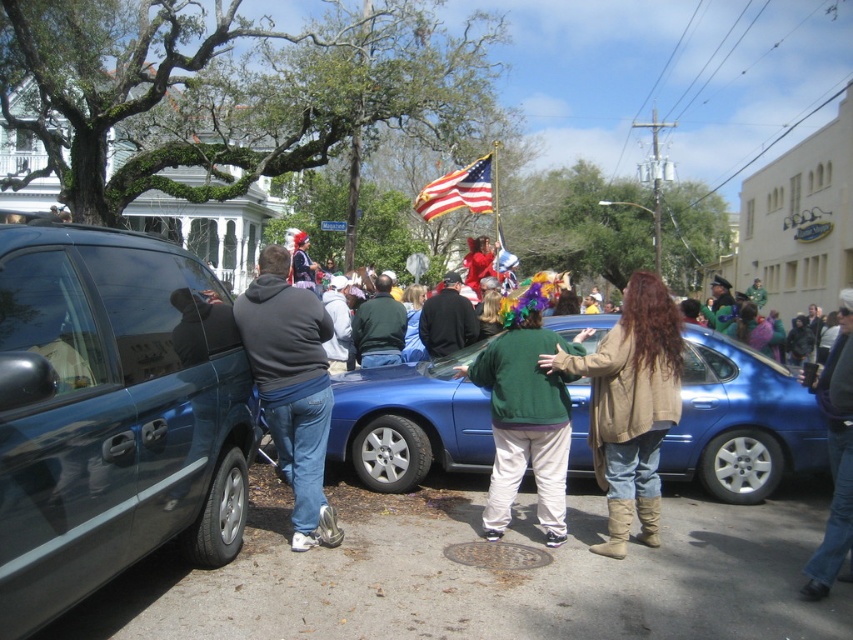
You are a delivery person who needs to park your 15 feet long truck between the blue metallic car at center and the american flag at center. Is there enough space between them to park your truck?

The blue metallic car at center and american flag at center are 20.51 feet apart. Since your truck is 15 feet long, there is enough space between them to park your truck as 20.51 feet is greater than 15 feet.

You are a photographer trying to capture both the green fleece jacket at center and the black matte jacket at center in a single shot. Based on their positions, which jacket should you focus on first to ensure both are in the frame?

The green fleece jacket at center is located below the black matte jacket at center, so you should focus on the black matte jacket at center first to ensure both are in the frame.